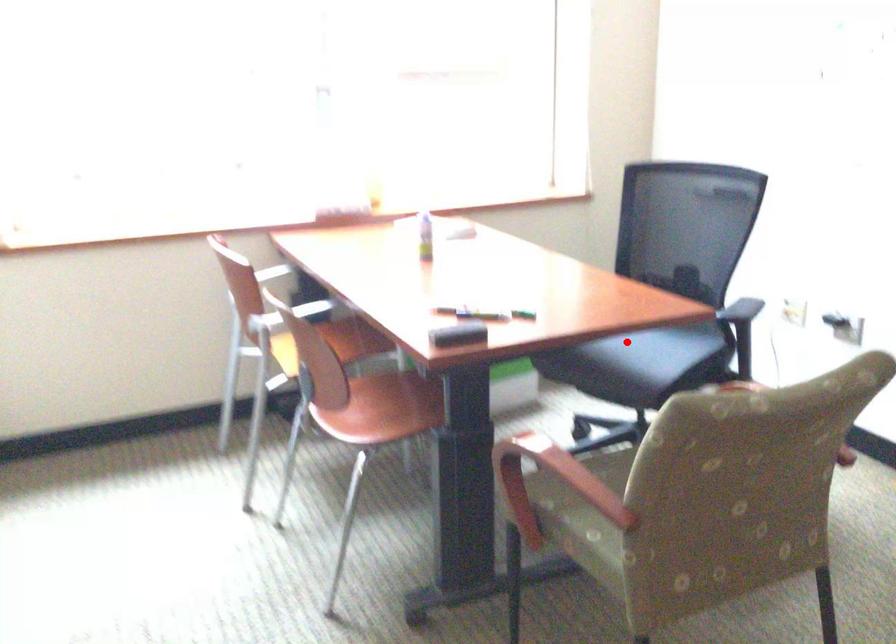
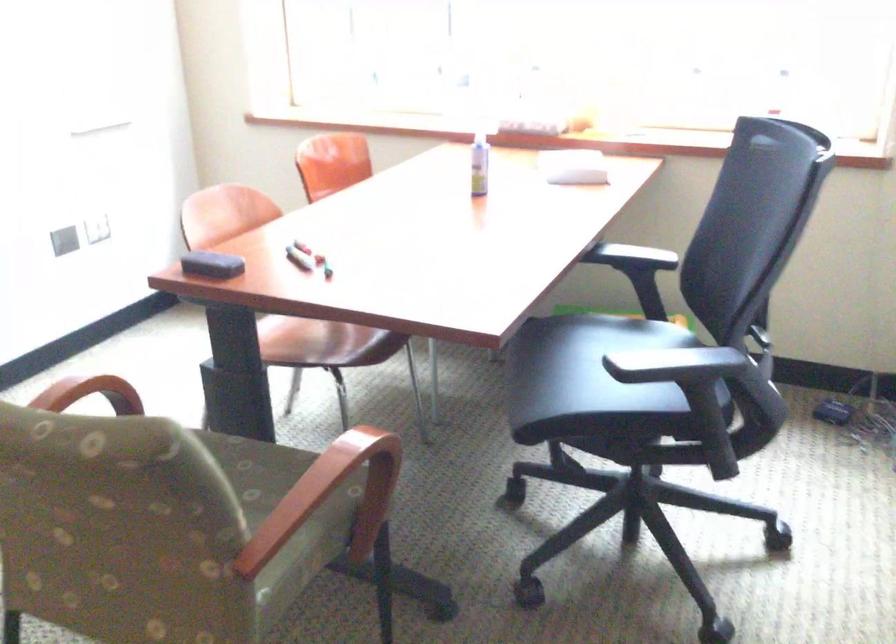
Question: I am providing you with two images of the same scene from different viewpoints. A red point is marked on the first image. Can you still see the location of the red point in image 2?

Choices:
 (A) Yes
 (B) No

Answer: (A)